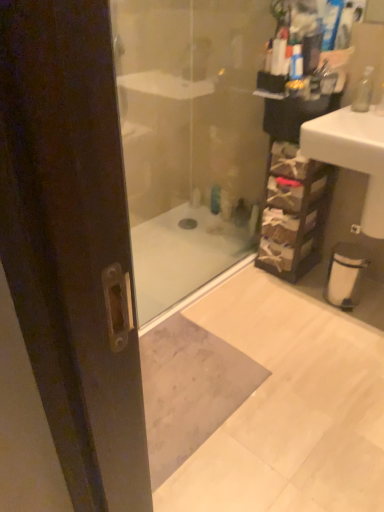
What do you see at coordinates (352, 155) in the screenshot?
I see `white glossy sink at right` at bounding box center [352, 155].

Locate an element on the screen. The height and width of the screenshot is (512, 384). transparent glass shower door at center is located at coordinates (189, 138).

Where is `translucent plastic bottle at center`? translucent plastic bottle at center is located at coordinates click(215, 199).

Is transparent glass shower door at center taller or shorter than white glossy sink at right?

In the image, transparent glass shower door at center appears to be taller than white glossy sink at right.

Is transparent glass shower door at center not near white glossy sink at right?

transparent glass shower door at center is actually quite close to white glossy sink at right.

At what (x,y) coordinates should I click in order to perform the action: click on sink below the transparent glass shower door at center (from the image's perspective). Please return your answer as a coordinate pair (x, y). Looking at the image, I should click on (352, 155).

Which is correct: transparent glass shower door at center is inside white glossy sink at right, or outside of it?

transparent glass shower door at center exists outside the volume of white glossy sink at right.

From the image's perspective, is transparent glass shower door at center positioned above or below clear glass soap dispenser at upper right?

Clearly, from the image's perspective, transparent glass shower door at center is below clear glass soap dispenser at upper right.

Considering the points (187, 249) and (364, 86), which point is behind, point (187, 249) or point (364, 86)?

The point (187, 249) is farther from the camera.

Is transparent glass shower door at center facing away from clear glass soap dispenser at upper right?

No, transparent glass shower door at center is not facing the opposite direction of clear glass soap dispenser at upper right.

Looking at their sizes, would you say transparent glass shower door at center is wider or thinner than clear glass soap dispenser at upper right?

In the image, transparent glass shower door at center appears to be wider than clear glass soap dispenser at upper right.

From the picture: How different are the orientations of white glossy sink at right and brown woven basket at right in degrees?

0.128 degrees separate the facing orientations of white glossy sink at right and brown woven basket at right.

From the picture: Is white glossy sink at right to the right of brown woven basket at right from the viewer's perspective?

Yes.

From the image's perspective, which is below, white glossy sink at right or brown woven basket at right?

From the image's view, brown woven basket at right is below.

Considering the sizes of objects translucent plastic bottle at center and brown woven basket at right in the image provided, who is smaller, translucent plastic bottle at center or brown woven basket at right?

Smaller between the two is translucent plastic bottle at center.

Considering the points (212, 191) and (291, 270), which point is behind, point (212, 191) or point (291, 270)?

The point (212, 191) is farther.

Is translucent plastic bottle at center in contact with brown woven basket at right?

No, translucent plastic bottle at center is not making contact with brown woven basket at right.

Between transparent glass shower door at center and translucent plastic bottle at center, which one has larger width?

transparent glass shower door at center is wider.

Considering the sizes of objects transparent glass shower door at center and translucent plastic bottle at center in the image provided, who is shorter, transparent glass shower door at center or translucent plastic bottle at center?

translucent plastic bottle at center.

I want to click on shower door on the left of translucent plastic bottle at center, so click(x=189, y=138).

Can you tell me how much transparent glass shower door at center and translucent plastic bottle at center differ in facing direction?

2.09 degrees separate the facing orientations of transparent glass shower door at center and translucent plastic bottle at center.

Is point (290, 208) behind point (145, 121)?

That is False.

From a real-world perspective, is brown woven basket at right located higher than transparent glass shower door at center?

No, from a real-world perspective, brown woven basket at right is not above transparent glass shower door at center.

Is the surface of brown woven basket at right in direct contact with transparent glass shower door at center?

No, brown woven basket at right is not in contact with transparent glass shower door at center.

Choose the correct answer: Is clear glass soap dispenser at upper right inside translucent plastic bottle at center or outside it?

clear glass soap dispenser at upper right exists outside the volume of translucent plastic bottle at center.

From the image's perspective, which is below, clear glass soap dispenser at upper right or translucent plastic bottle at center?

From the image's view, translucent plastic bottle at center is below.

Is point (366, 69) closer or farther from the camera than point (211, 191)?

Point (366, 69).

Is clear glass soap dispenser at upper right to the left of translucent plastic bottle at center from the viewer's perspective?

No.

This screenshot has height=512, width=384. What are the coordinates of `sink lying below the transparent glass shower door at center (from the image's perspective)` in the screenshot? It's located at (352, 155).

The height and width of the screenshot is (512, 384). There is a transparent glass shower door at center. Identify the location of soap dispenser above it (from a real-world perspective). (363, 91).

Based on their spatial positions, is brown woven basket at right or white glossy sink at right closer to clear glass soap dispenser at upper right?

Based on the image, white glossy sink at right appears to be nearer to clear glass soap dispenser at upper right.

Based on their spatial positions, is translucent plastic bottle at center or clear glass soap dispenser at upper right closer to brown woven basket at right?

Based on the image, translucent plastic bottle at center appears to be nearer to brown woven basket at right.

Looking at the image, which one is located further to white glossy sink at right, clear glass soap dispenser at upper right or transparent glass shower door at center?

transparent glass shower door at center is further to white glossy sink at right.

Which object lies nearer to the anchor point clear glass soap dispenser at upper right, translucent plastic bottle at center or transparent glass shower door at center?

translucent plastic bottle at center lies closer to clear glass soap dispenser at upper right than the other object.

In the scene shown: When comparing their distances from transparent glass shower door at center, does brown woven basket at right or translucent plastic bottle at center seem closer?

translucent plastic bottle at center lies closer to transparent glass shower door at center than the other object.

Based on their spatial positions, is transparent glass shower door at center or clear glass soap dispenser at upper right further from white glossy sink at right?

transparent glass shower door at center.

When comparing their distances from translucent plastic bottle at center, does clear glass soap dispenser at upper right or transparent glass shower door at center seem closer?

transparent glass shower door at center lies closer to translucent plastic bottle at center than the other object.

Which object lies further to the anchor point translucent plastic bottle at center, brown woven basket at right or clear glass soap dispenser at upper right?

The object further to translucent plastic bottle at center is clear glass soap dispenser at upper right.

This screenshot has height=512, width=384. Find the location of `sink between clear glass soap dispenser at upper right and brown woven basket at right vertically`. sink between clear glass soap dispenser at upper right and brown woven basket at right vertically is located at coordinates (352, 155).

Find the location of a particular element. This screenshot has height=512, width=384. soap dispenser between white glossy sink at right and translucent plastic bottle at center from front to back is located at coordinates (363, 91).

Locate an element on the screen. The image size is (384, 512). shelf positioned between transparent glass shower door at center and translucent plastic bottle at center from near to far is located at coordinates 294,212.

Find the location of a particular element. sink positioned between transparent glass shower door at center and translucent plastic bottle at center from near to far is located at coordinates (352, 155).